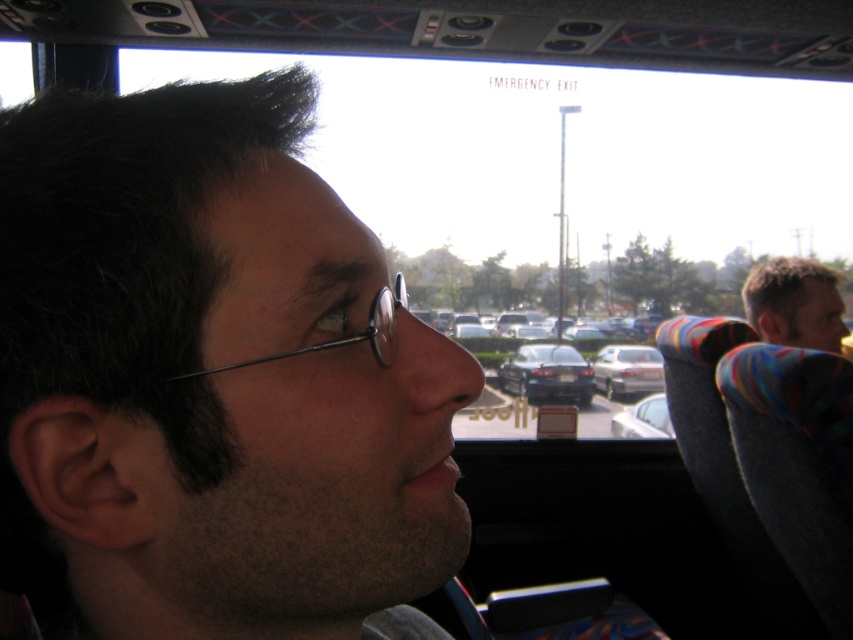
Question: Which object appears closest to the camera in this image?

Choices:
 (A) dark hair at left
 (B) blonde hair at right
 (C) satin silver sedan at center
 (D) semi-transparent plastic glasses at center

Answer: (A)

Question: Which point is farther to the camera?

Choices:
 (A) matte black car at center
 (B) dark hair at left

Answer: (A)

Question: Is blonde hair at right closer to the viewer compared to matte black car at center?

Choices:
 (A) no
 (B) yes

Answer: (B)

Question: Which point is closer to the camera taking this photo?

Choices:
 (A) (390, 352)
 (B) (669, 422)

Answer: (A)

Question: Does blonde hair at right have a larger size compared to white glossy car at center?

Choices:
 (A) no
 (B) yes

Answer: (A)

Question: Can you confirm if blonde hair at right is wider than white glossy car at center?

Choices:
 (A) no
 (B) yes

Answer: (A)